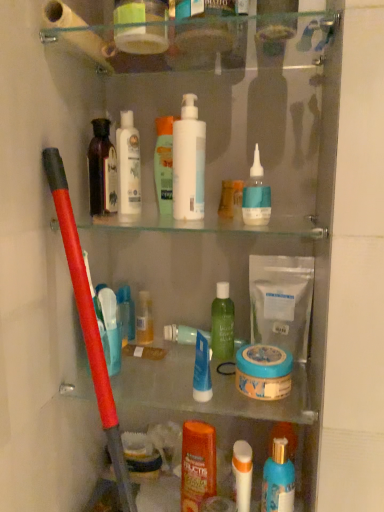
Question: Which direction should I rotate to look at translucent plastic container at upper center, marked as the eighth toiletry in a bottom-to-top arrangement?

Choices:
 (A) right
 (B) left

Answer: (B)

Question: Can you confirm if blue matte bottle at upper right, the third cleaning product positioned from the left, is positioned to the left of white matte pump bottle at center, which is the 3th cleaning product from right to left?

Choices:
 (A) yes
 (B) no

Answer: (B)

Question: Considering the relative sizes of blue matte bottle at upper right, the 2th cleaning product when ordered from right to left, and white matte pump bottle at center, which is the 3th cleaning product from right to left, in the image provided, is blue matte bottle at upper right, the 2th cleaning product when ordered from right to left, wider than white matte pump bottle at center, which is the 3th cleaning product from right to left,?

Choices:
 (A) yes
 (B) no

Answer: (A)

Question: Is blue matte bottle at upper right, the 2th cleaning product when ordered from right to left, further to camera compared to white matte pump bottle at center, the 2th cleaning product positioned from the left?

Choices:
 (A) yes
 (B) no

Answer: (B)

Question: Can you confirm if blue matte bottle at upper right, the 2th cleaning product when ordered from right to left, is taller than white matte pump bottle at center, which is the 3th cleaning product from right to left?

Choices:
 (A) no
 (B) yes

Answer: (A)

Question: Is blue matte bottle at upper right, the third cleaning product positioned from the left, positioned beyond the bounds of white matte pump bottle at center, which is the 3th cleaning product from right to left?

Choices:
 (A) yes
 (B) no

Answer: (A)

Question: Considering the relative sizes of blue matte bottle at upper right, the 2th cleaning product when ordered from right to left, and white matte pump bottle at center, the 2th cleaning product positioned from the left, in the image provided, is blue matte bottle at upper right, the 2th cleaning product when ordered from right to left, shorter than white matte pump bottle at center, the 2th cleaning product positioned from the left,?

Choices:
 (A) no
 (B) yes

Answer: (B)

Question: Does dark brown glass bottle at upper left, which is the third toiletry in top-to-bottom order, lie behind blue matte jar at center, the second mouthwash from the bottom?

Choices:
 (A) no
 (B) yes

Answer: (B)

Question: Is dark brown glass bottle at upper left, which is the third toiletry in top-to-bottom order, beside blue matte jar at center, positioned as the 1th mouthwash in top-to-bottom order?

Choices:
 (A) no
 (B) yes

Answer: (A)

Question: From a real-world perspective, is dark brown glass bottle at upper left, which is the third toiletry in top-to-bottom order, on top of blue matte jar at center, the second mouthwash from the bottom?

Choices:
 (A) no
 (B) yes

Answer: (B)

Question: Would you say dark brown glass bottle at upper left, placed as the sixth toiletry when sorted from bottom to top, contains blue matte jar at center, the second mouthwash from the bottom?

Choices:
 (A) yes
 (B) no

Answer: (B)

Question: Is dark brown glass bottle at upper left, placed as the sixth toiletry when sorted from bottom to top, at the right side of blue matte jar at center, the second mouthwash from the bottom?

Choices:
 (A) yes
 (B) no

Answer: (B)

Question: Could you tell me if dark brown glass bottle at upper left, which is the third toiletry in top-to-bottom order, is turned towards blue matte jar at center, the second mouthwash from the bottom?

Choices:
 (A) yes
 (B) no

Answer: (B)

Question: Considering the relative sizes of green matte bottle at center, which ranks as the fifth toiletry in bottom-to-top order, and white matte bag at center, which is the 4th cleaning product in left-to-right order, in the image provided, is green matte bottle at center, which ranks as the fifth toiletry in bottom-to-top order, taller than white matte bag at center, which is the 4th cleaning product in left-to-right order,?

Choices:
 (A) no
 (B) yes

Answer: (A)